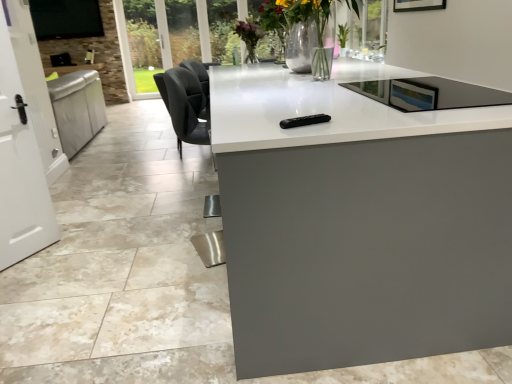
You are a GUI agent. You are given a task and a screenshot of the screen. Output one action in this format:
    pyautogui.click(x=<x>, y=<y>)
    Task: Click on the free space that is in between white glossy door at left and black leather swivel chair at center
    The height and width of the screenshot is (384, 512).
    Given the screenshot: What is the action you would take?
    pyautogui.click(x=136, y=188)